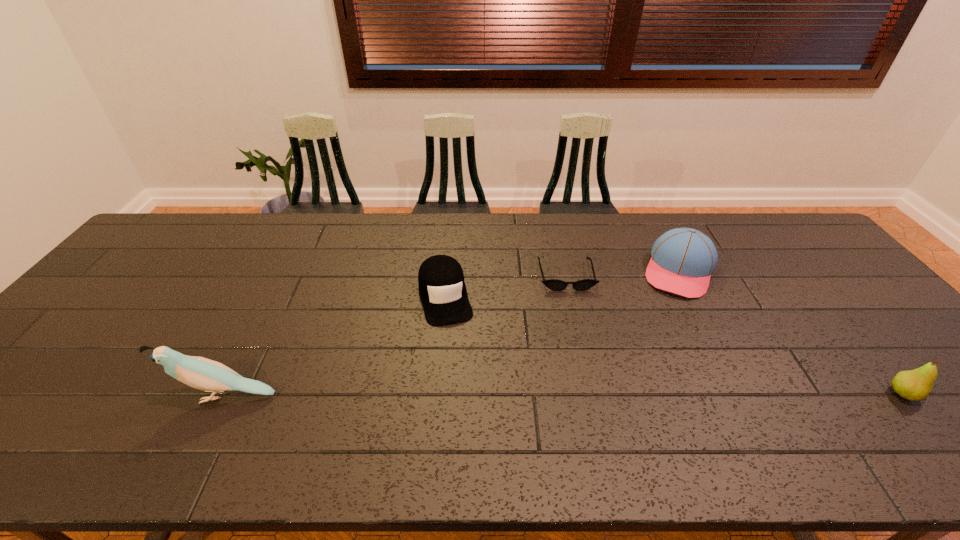
Locate an element on the screen. The image size is (960, 540). free spot between the rightmost object and the fourth object from left to right is located at coordinates (791, 333).

Find the location of a particular element. This screenshot has width=960, height=540. empty location between the second object from right to left and the shortest object is located at coordinates (622, 273).

Identify the location of free space between the shortest object and the bird. (395, 335).

This screenshot has height=540, width=960. What are the coordinates of `free space that is in between the third object from left to right and the tallest object` in the screenshot? It's located at (395, 335).

Identify the location of empty location between the pear and the second object from right to left. (791, 333).

Locate an element on the screen. This screenshot has height=540, width=960. vacant area that lies between the sunglasses and the tallest object is located at coordinates (395, 335).

Locate an element on the screen. The image size is (960, 540). unoccupied position between the second shortest object and the tallest object is located at coordinates [x=335, y=346].

Image resolution: width=960 pixels, height=540 pixels. In order to click on vacant space that is in between the pear and the second shortest object in this screenshot , I will do `click(675, 345)`.

I want to click on unoccupied area between the cap and the leftmost object, so click(x=335, y=346).

Choose which object is the nearest neighbor to the tallest object. Please provide its 2D coordinates. Your answer should be formatted as a tuple, i.e. [(x, y)], where the tuple contains the x and y coordinates of a point satisfying the conditions above.

[(442, 289)]